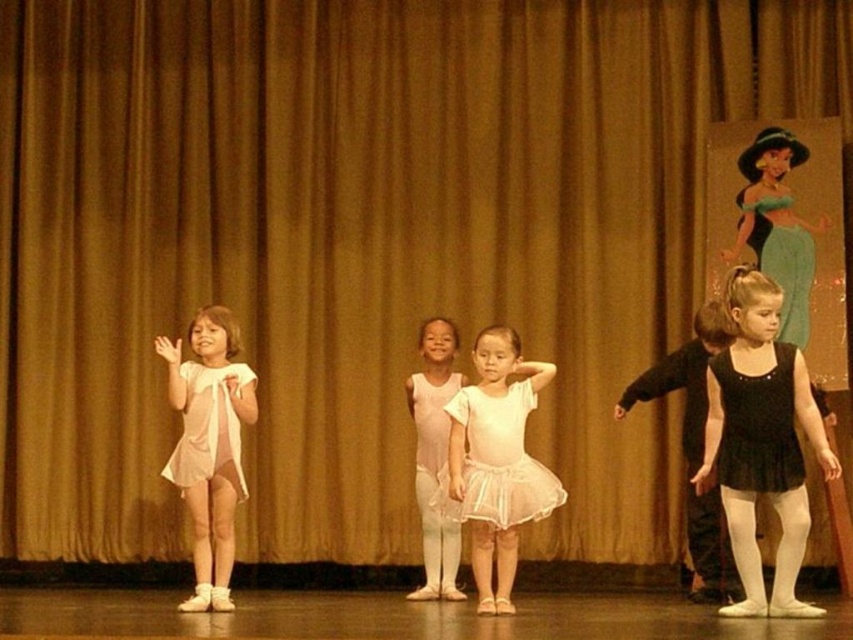
Question: Which point is farther to the camera?

Choices:
 (A) (241, 397)
 (B) (451, 561)

Answer: (B)

Question: Is matte pink leotard at left smaller than pink satin tutu at center?

Choices:
 (A) no
 (B) yes

Answer: (A)

Question: Which point appears farthest from the camera in this image?

Choices:
 (A) (772, 256)
 (B) (428, 532)
 (C) (809, 236)

Answer: (C)

Question: Is white tulle skirt at center behind black satin dress at lower right?

Choices:
 (A) no
 (B) yes

Answer: (B)

Question: Considering the real-world distances, which object is closest to the pink satin tutu at center?

Choices:
 (A) black matte ballet dress at right
 (B) matte pink leotard at left
 (C) black satin dress at lower right
 (D) black satin leotard at center

Answer: (B)

Question: Can you confirm if pink satin tutu at center is positioned below translucent white dress at left?

Choices:
 (A) yes
 (B) no

Answer: (A)